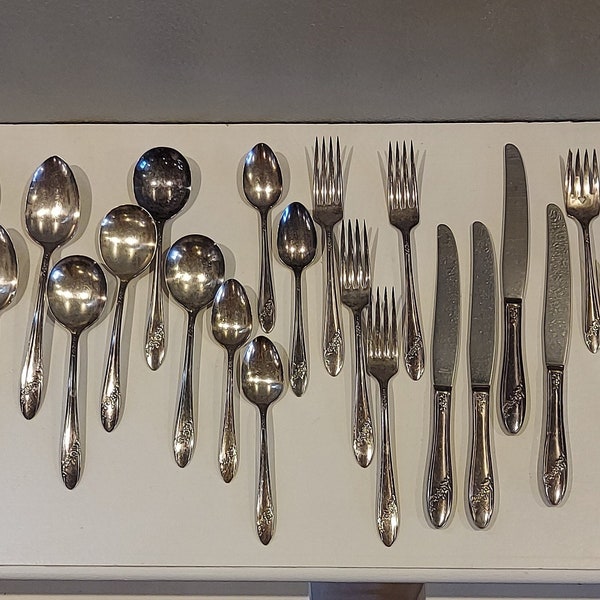
Locate an element on the screen. spoons is located at coordinates (10, 266), (55, 193), (65, 296), (116, 247), (179, 165), (193, 270), (220, 315), (262, 386), (294, 228), (268, 180).